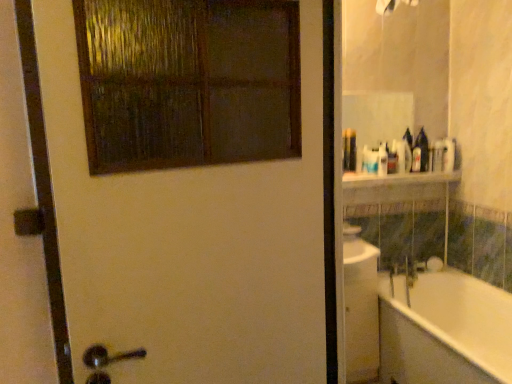
Question: From a real-world perspective, is white glossy bathtub at right above or below white glossy shelf at upper center?

Choices:
 (A) below
 (B) above

Answer: (A)

Question: Is white glossy bathtub at right situated inside white glossy shelf at upper center or outside?

Choices:
 (A) outside
 (B) inside

Answer: (A)

Question: Based on their relative distances, which object is farther from the translucent plastic bottle at upper right?

Choices:
 (A) white matte door at upper left
 (B) white glossy shelf at upper center
 (C) white glossy bathtub at right

Answer: (A)

Question: Which of these objects is positioned farthest from the white glossy bathtub at right?

Choices:
 (A) white glossy shelf at upper center
 (B) translucent plastic bottle at upper right
 (C) white matte door at upper left

Answer: (C)